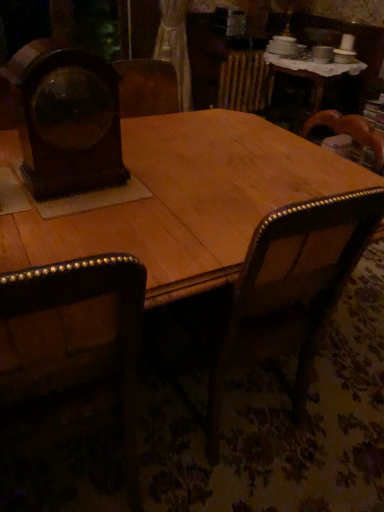
The image size is (384, 512). Find the location of `free space on the front side of wooden clock at left`. free space on the front side of wooden clock at left is located at coordinates (70, 215).